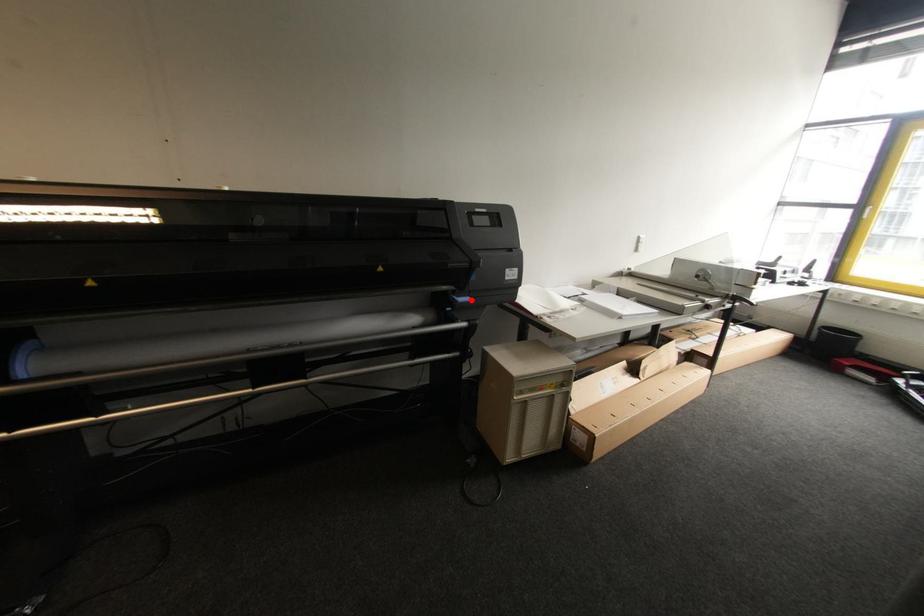
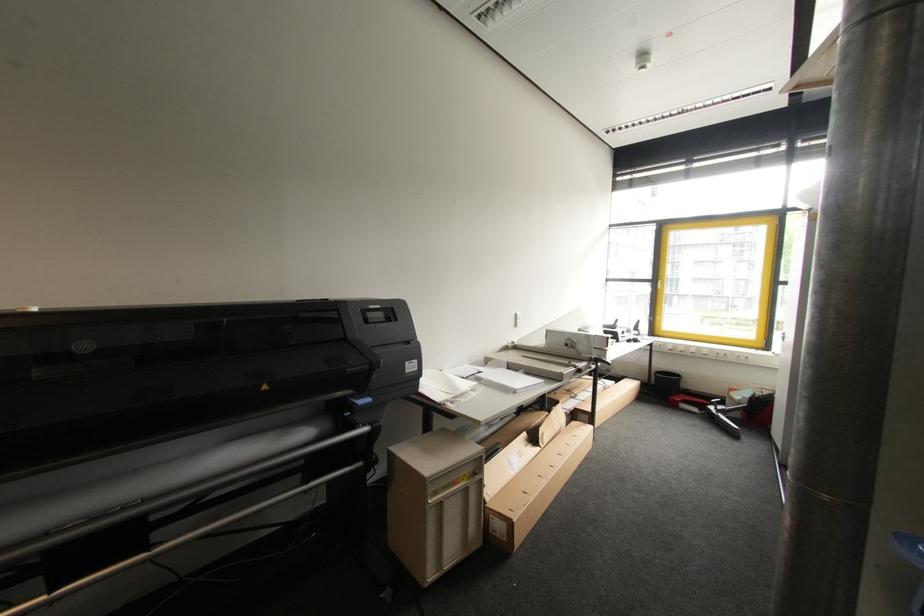
Question: I am providing you with two images of the same scene from different viewpoints. A red point is marked on the first image. At the location where the point appears in image 1, is it still visible in image 2?

Choices:
 (A) Yes
 (B) No

Answer: (A)